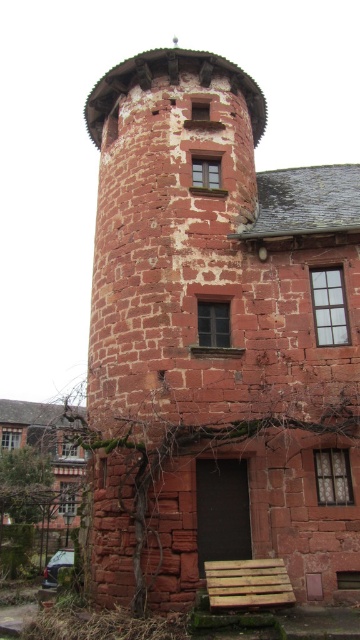
Question: Does red stone tower at center appear on the right side of wooden pallet at lower center?

Choices:
 (A) no
 (B) yes

Answer: (B)

Question: Can you confirm if red stone tower at center is bigger than wooden pallet at lower center?

Choices:
 (A) no
 (B) yes

Answer: (B)

Question: Is red stone tower at center below wooden pallet at lower center?

Choices:
 (A) no
 (B) yes

Answer: (A)